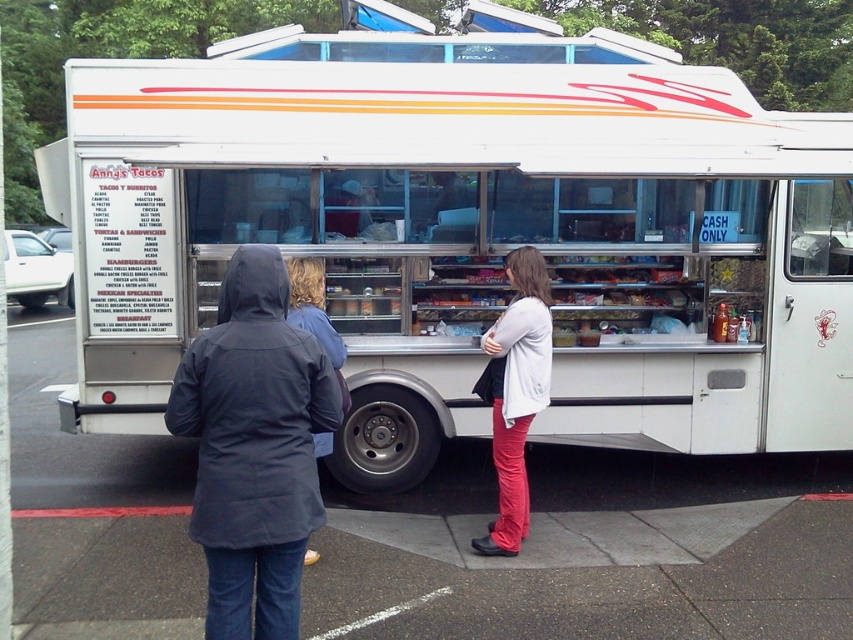
Question: In this image, where is white metallic food truck at center located relative to matte white sweater at center?

Choices:
 (A) left
 (B) right

Answer: (B)

Question: Observing the image, what is the correct spatial positioning of matte white sweater at center in reference to dark blue hooded jacket at center?

Choices:
 (A) above
 (B) below

Answer: (B)

Question: Which of the following is the closest to the observer?

Choices:
 (A) dark blue hooded jacket at center
 (B) dark blue hooded jacket at left

Answer: (B)

Question: In this image, where is white metallic food truck at center located relative to dark blue hooded jacket at left?

Choices:
 (A) right
 (B) left

Answer: (A)

Question: Which point appears closest to the camera in this image?

Choices:
 (A) (527, 344)
 (B) (682, 83)

Answer: (A)

Question: Which of the following is the closest to the observer?

Choices:
 (A) (529, 372)
 (B) (149, 417)

Answer: (A)